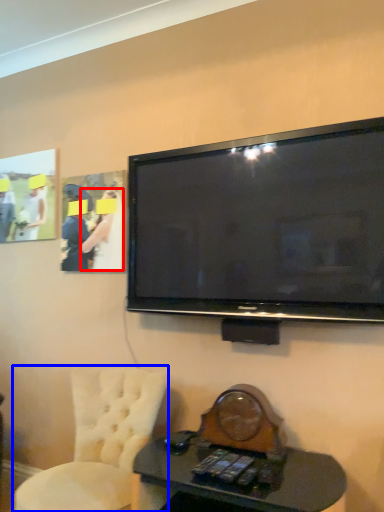
Question: Which object is closer to the camera taking this photo, person (highlighted by a red box) or chair (highlighted by a blue box)?

Choices:
 (A) person
 (B) chair

Answer: (B)